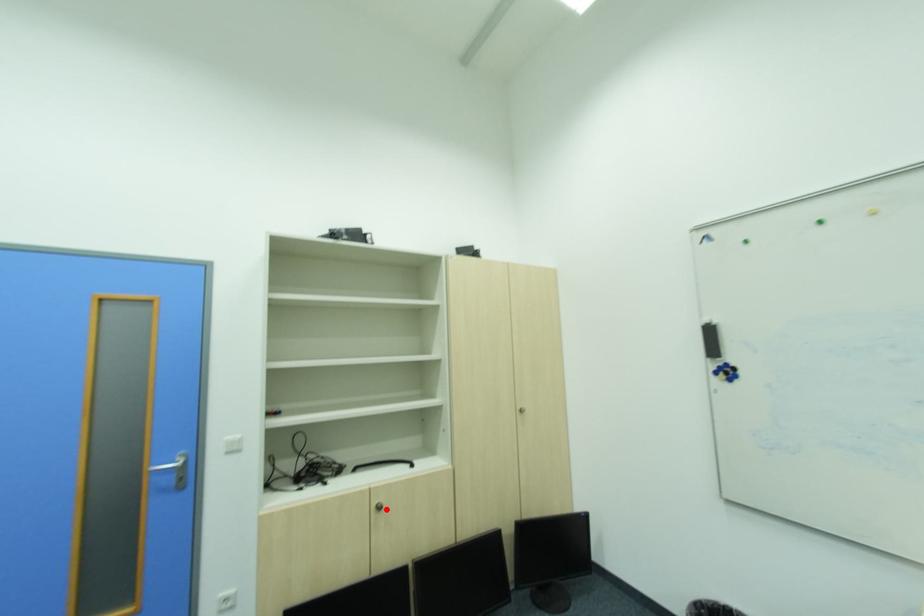
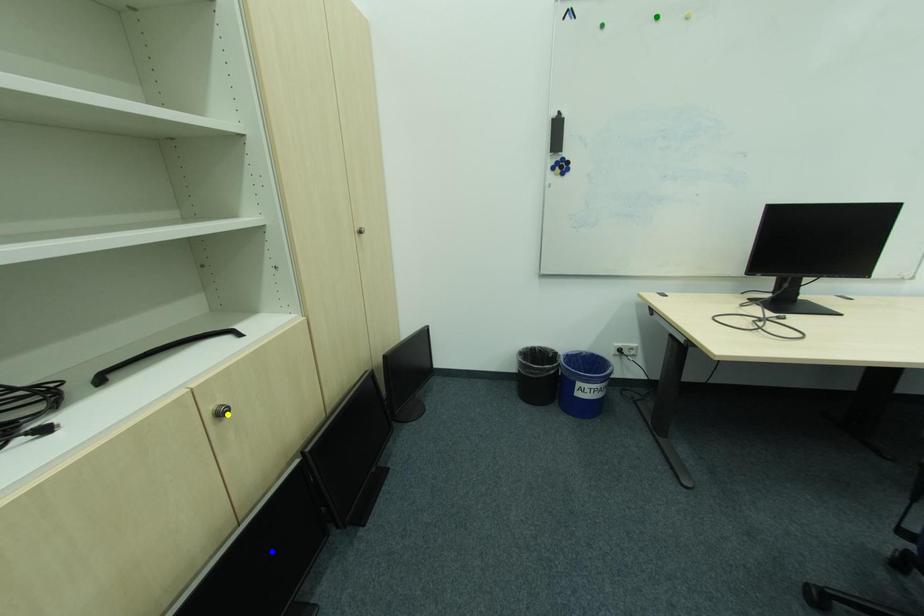
Question: I am providing you with two images of the same scene from different viewpoints. A red point is marked on the first image. You are given multiple points on the second image. Which mark in image 2 goes with the point in image 1?

Choices:
 (A) green point
 (B) blue point
 (C) yellow point

Answer: (C)